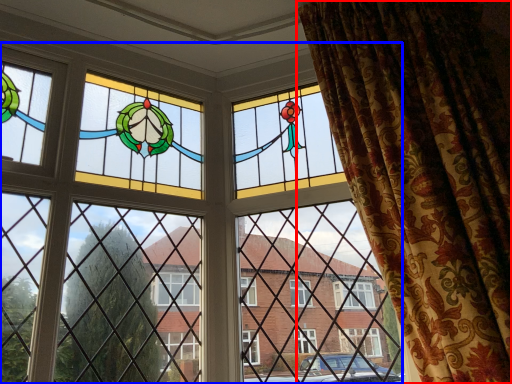
Question: Among these objects, which one is farthest to the camera, curtain (highlighted by a red box) or window (highlighted by a blue box)?

Choices:
 (A) curtain
 (B) window

Answer: (B)